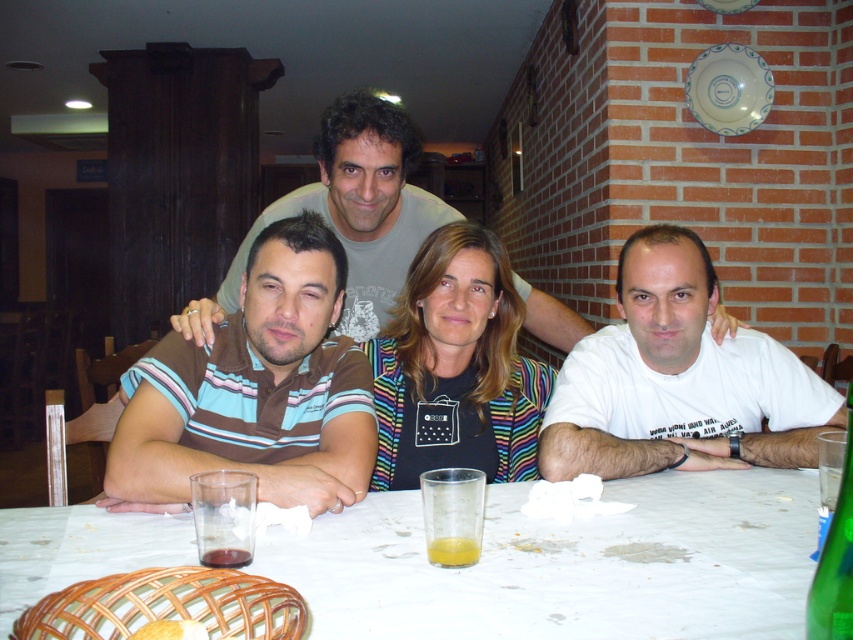
Question: Among these objects, which one is nearest to the camera?

Choices:
 (A) white cotton shirt at right
 (B) yellow translucent glass at table center

Answer: (B)

Question: Which object is closer to the camera taking this photo?

Choices:
 (A) white cotton shirt at right
 (B) white paper table at center
 (C) yellow translucent liquid at table center
 (D) translucent glass at table center

Answer: (B)

Question: Is white paper table at center to the left of brown striped shirt at center from the viewer's perspective?

Choices:
 (A) no
 (B) yes

Answer: (A)

Question: Is yellow translucent glass at table center wider than yellow translucent liquid at table center?

Choices:
 (A) yes
 (B) no

Answer: (A)

Question: Which object is the closest to the brown striped shirt at center?

Choices:
 (A) translucent glass at table center
 (B) green glass bottle at table right
 (C) white cotton shirt at right

Answer: (A)

Question: Does white paper table at center come in front of green glass bottle at table right?

Choices:
 (A) yes
 (B) no

Answer: (B)